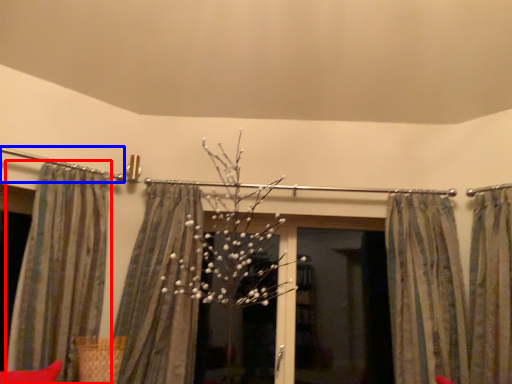
Question: Which object appears farthest to the camera in this image, curtain (highlighted by a red box) or clothesline (highlighted by a blue box)?

Choices:
 (A) curtain
 (B) clothesline

Answer: (B)